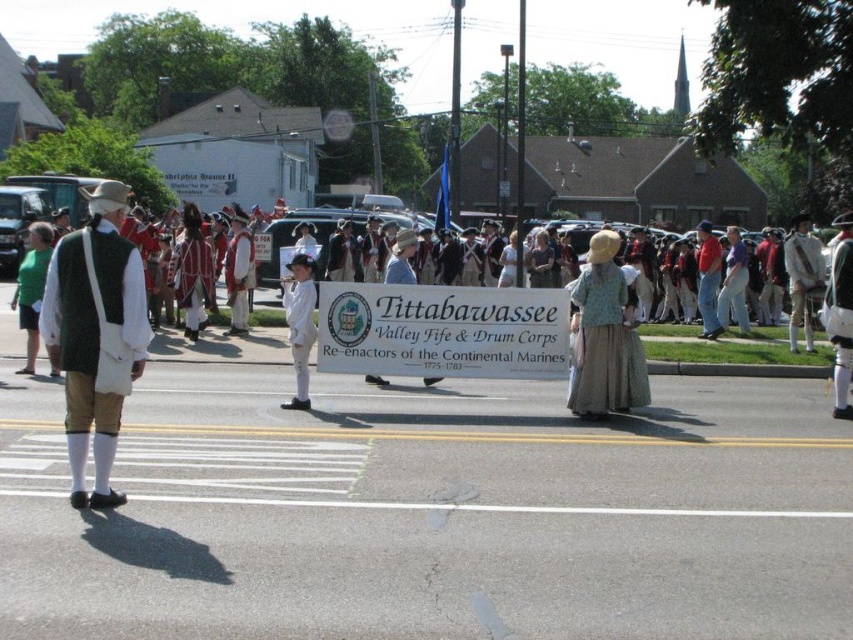
Question: Which of the following is the closest to the observer?

Choices:
 (A) white linen shirt at center
 (B) white cotton shirt at center
 (C) light blue fabric dress at center

Answer: (C)

Question: Based on their relative distances, which object is farther from the light blue fabric dress at center?

Choices:
 (A) white linen shirt at center
 (B) red shirt at center
 (C) white cotton shirt at center
 (D) green wool vest at left

Answer: (B)

Question: Does white cotton shirt at center come behind red shirt at center?

Choices:
 (A) no
 (B) yes

Answer: (A)

Question: Observing the image, what is the correct spatial positioning of white linen shirt at center in reference to white cotton shirt at center?

Choices:
 (A) below
 (B) above

Answer: (B)

Question: Based on their relative distances, which object is nearer to the light blue fabric dress at center?

Choices:
 (A) white cotton shirt at center
 (B) white linen shirt at center
 (C) red shirt at center
 (D) green wool vest at left

Answer: (A)

Question: Can you confirm if white linen shirt at center is positioned above white cotton shirt at center?

Choices:
 (A) no
 (B) yes

Answer: (B)